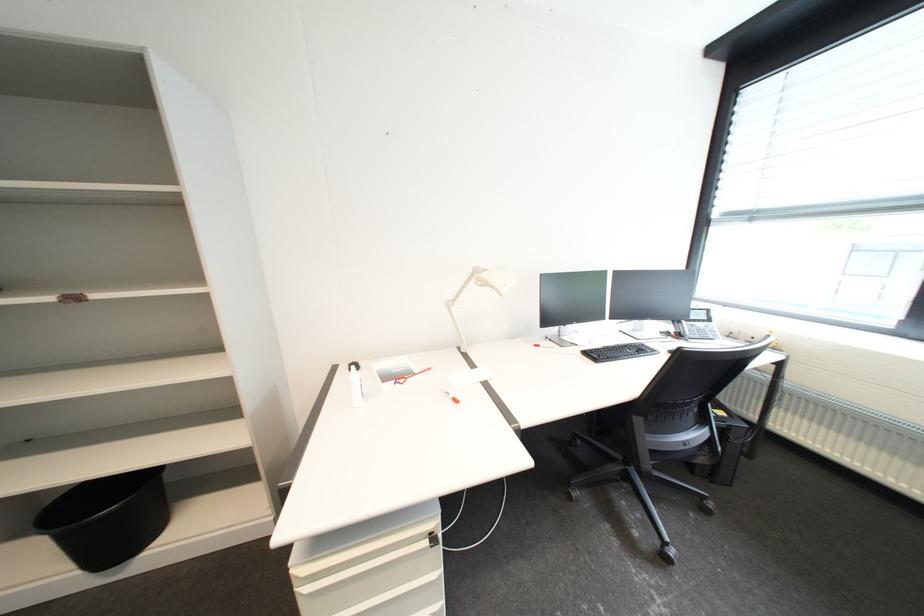
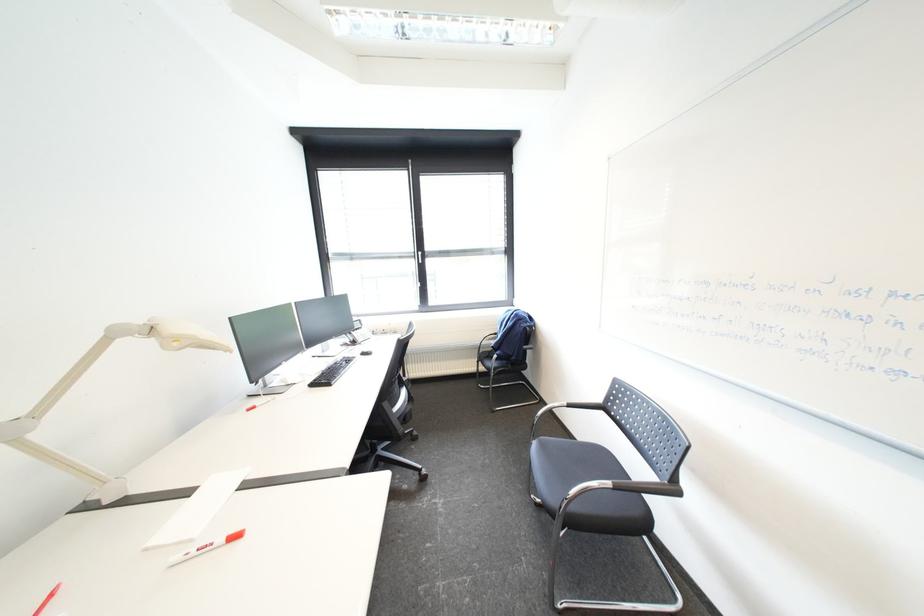
Question: Based on the continuous images, in which direction is the camera rotating? Reply with the corresponding letter.

Choices:
 (A) Left
 (B) Right
 (C) Up
 (D) Down

Answer: (B)